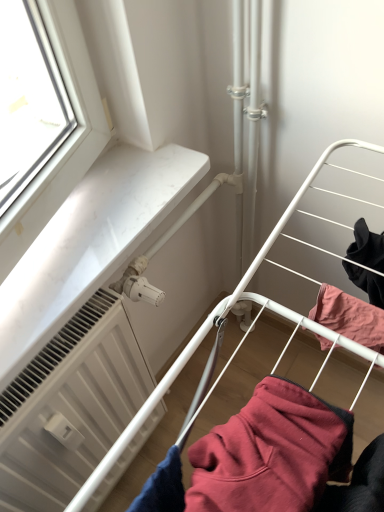
Image resolution: width=384 pixels, height=512 pixels. In order to click on maroon fleece sweatshirt at center in this screenshot , I will do `click(272, 453)`.

Image resolution: width=384 pixels, height=512 pixels. What do you see at coordinates (272, 453) in the screenshot? I see `maroon fleece sweatshirt at center` at bounding box center [272, 453].

This screenshot has height=512, width=384. I want to click on white matte radiator at lower left, so click(x=70, y=405).

What do you see at coordinates (70, 405) in the screenshot?
I see `white matte radiator at lower left` at bounding box center [70, 405].

Identify the location of maroon fleece sweatshirt at center. (272, 453).

Between maroon fleece sweatshirt at center and white matte radiator at lower left, which one appears on the right side from the viewer's perspective?

Positioned to the right is maroon fleece sweatshirt at center.

Which is in front, maroon fleece sweatshirt at center or white matte radiator at lower left?

maroon fleece sweatshirt at center is in front.

Is point (261, 438) closer or farther from the camera than point (52, 382)?

Point (261, 438) is closer to the camera than point (52, 382).

From the image's perspective, is maroon fleece sweatshirt at center below white matte radiator at lower left?

No.

From a real-world perspective, is maroon fleece sweatshirt at center above or below white matte radiator at lower left?

maroon fleece sweatshirt at center is above white matte radiator at lower left.

Consider the image. Can you confirm if maroon fleece sweatshirt at center is wider than white matte radiator at lower left?

Correct, the width of maroon fleece sweatshirt at center exceeds that of white matte radiator at lower left.

From the picture: Is maroon fleece sweatshirt at center shorter than white matte radiator at lower left?

Correct, maroon fleece sweatshirt at center is not as tall as white matte radiator at lower left.

In the scene shown: Who is smaller, maroon fleece sweatshirt at center or white matte radiator at lower left?

maroon fleece sweatshirt at center.

From the picture: Is white matte radiator at lower left a part of maroon fleece sweatshirt at center?

No, white matte radiator at lower left is not surrounded by maroon fleece sweatshirt at center.

Looking at this image, is maroon fleece sweatshirt at center not near white matte radiator at lower left?

Actually, maroon fleece sweatshirt at center and white matte radiator at lower left are a little close together.

Is white matte radiator at lower left at the back of maroon fleece sweatshirt at center?

Correct, maroon fleece sweatshirt at center is looking away from white matte radiator at lower left.

This screenshot has width=384, height=512. Find the location of `radiator below the maroon fleece sweatshirt at center (from the image's perspective)`. radiator below the maroon fleece sweatshirt at center (from the image's perspective) is located at coordinates (70, 405).

Based on their positions, is white matte radiator at lower left located to the left or right of maroon fleece sweatshirt at center?

In the image, white matte radiator at lower left appears on the left side of maroon fleece sweatshirt at center.

Which is in front, white matte radiator at lower left or maroon fleece sweatshirt at center?

maroon fleece sweatshirt at center.

Considering the positions of point (107, 356) and point (318, 416), is point (107, 356) closer or farther from the camera than point (318, 416)?

Point (107, 356) appears to be farther away from the viewer than point (318, 416).

From the image's perspective, is white matte radiator at lower left under maroon fleece sweatshirt at center?

Yes.

From a real-world perspective, who is located lower, white matte radiator at lower left or maroon fleece sweatshirt at center?

From a 3D spatial view, white matte radiator at lower left is below.

Is white matte radiator at lower left wider than maroon fleece sweatshirt at center?

No, white matte radiator at lower left is not wider than maroon fleece sweatshirt at center.

Can you confirm if white matte radiator at lower left is shorter than maroon fleece sweatshirt at center?

Incorrect, the height of white matte radiator at lower left does not fall short of that of maroon fleece sweatshirt at center.

Based on the photo, is white matte radiator at lower left smaller than maroon fleece sweatshirt at center?

Actually, white matte radiator at lower left might be larger than maroon fleece sweatshirt at center.

Is white matte radiator at lower left inside the boundaries of maroon fleece sweatshirt at center, or outside?

white matte radiator at lower left is not inside maroon fleece sweatshirt at center, it's outside.

Is white matte radiator at lower left in contact with maroon fleece sweatshirt at center?

No, white matte radiator at lower left is not next to maroon fleece sweatshirt at center.

Is white matte radiator at lower left oriented towards maroon fleece sweatshirt at center?

Yes, white matte radiator at lower left is facing maroon fleece sweatshirt at center.

How many degrees apart are the facing directions of white matte radiator at lower left and maroon fleece sweatshirt at center?

The facing directions of white matte radiator at lower left and maroon fleece sweatshirt at center are 0.000476 degrees apart.

Measure the distance between white matte radiator at lower left and maroon fleece sweatshirt at center.

white matte radiator at lower left and maroon fleece sweatshirt at center are 18.40 inches apart.

Find the location of `radiator below the maroon fleece sweatshirt at center (from the image's perspective)`. radiator below the maroon fleece sweatshirt at center (from the image's perspective) is located at coordinates (70, 405).

Image resolution: width=384 pixels, height=512 pixels. Identify the location of clothing on the right of white matte radiator at lower left. (272, 453).

Where is `clothing in front of the white matte radiator at lower left`? The image size is (384, 512). clothing in front of the white matte radiator at lower left is located at coordinates coord(272,453).